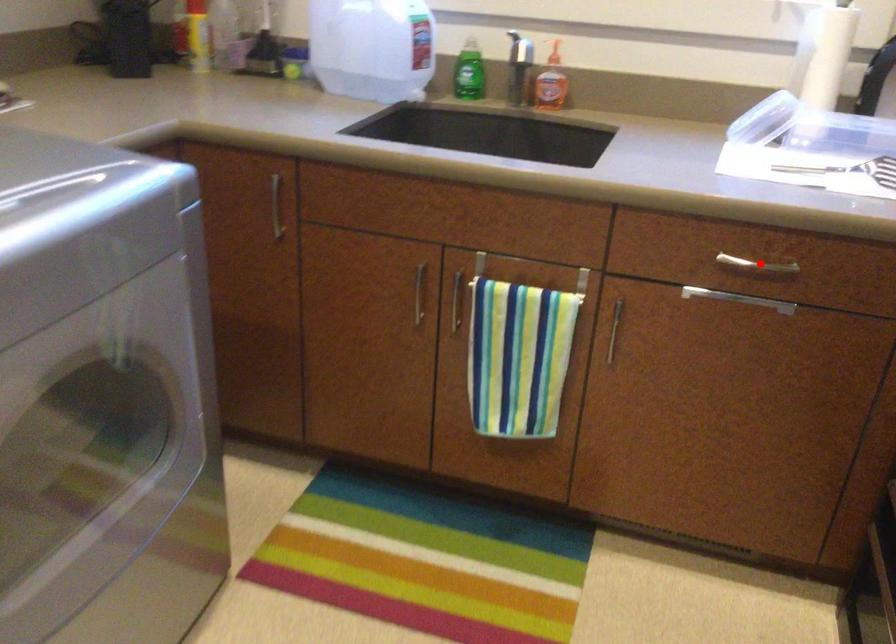
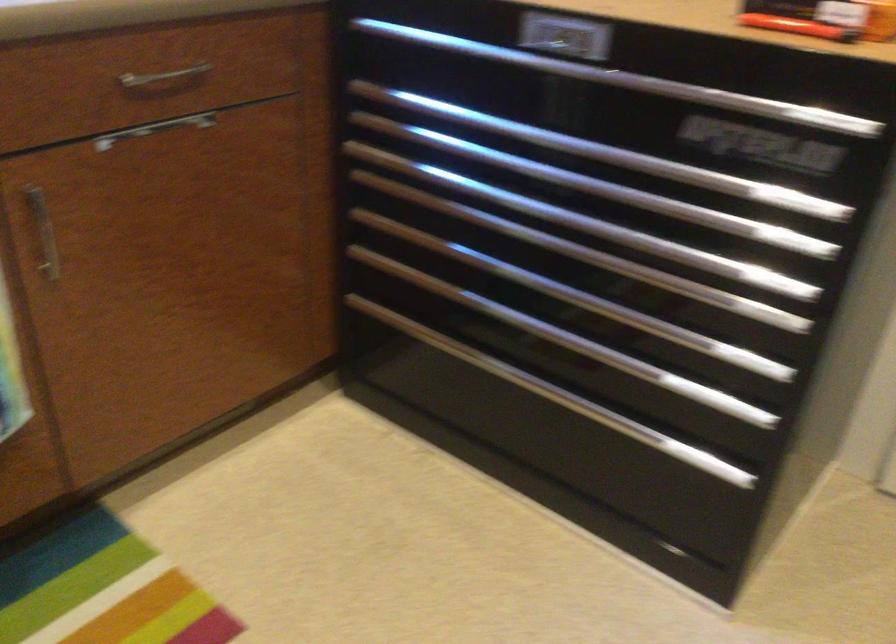
The point at the highlighted location is marked in the first image. Where is the corresponding point in the second image?

(164, 78)